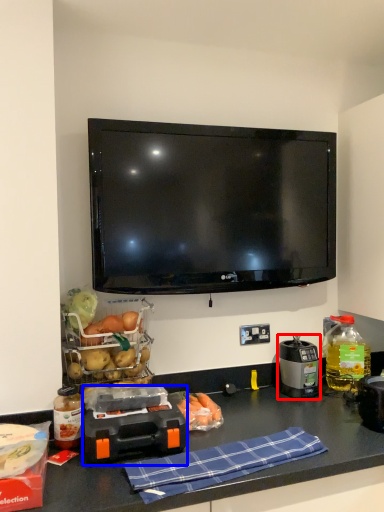
Question: Among these objects, which one is nearest to the camera, kitchen appliance (highlighted by a red box) or appliance (highlighted by a blue box)?

Choices:
 (A) kitchen appliance
 (B) appliance

Answer: (B)